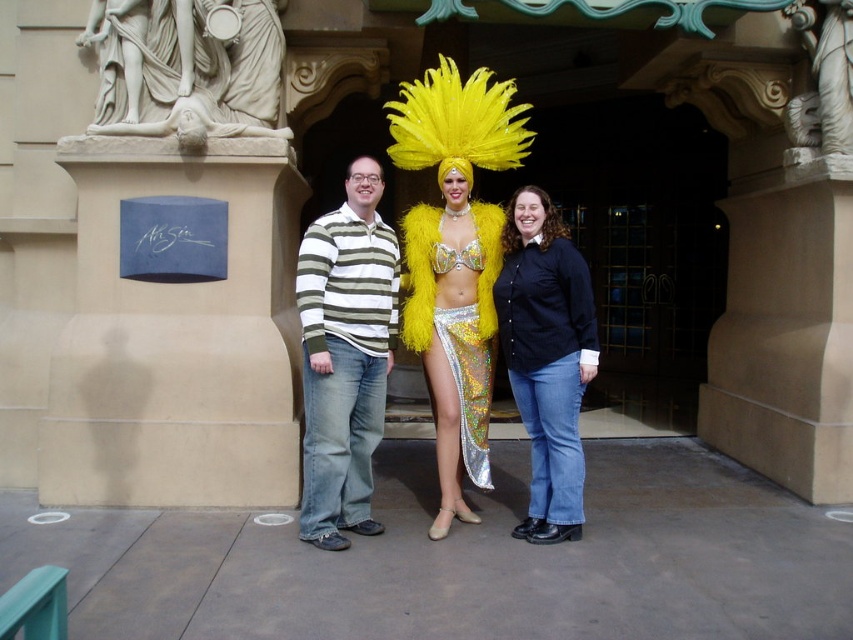
From the picture: You are taking a photo of the scene and want to focus on two specific points in the image, point 1 at coordinates point (485, 365) and point 2 at coordinates point (596, 356). Which point should you focus on first if you want to ensure both points are in focus?

You should focus on point 1 at coordinates point (485, 365) first because it is closer to the camera than point 2 at coordinates point (596, 356). This ensures that both points will be in focus when using a proper depth of field.

Consider the image. You are a photographer trying to capture the shiny metallic skirt at center in the image. The camera you are using has a focus point at coordinate point (457,346). Will this focus point help you capture the shiny metallic skirt at center?

Yes, the point (457,346) indicates the location of the shiny metallic skirt at center, so using this focus point will help you capture it.